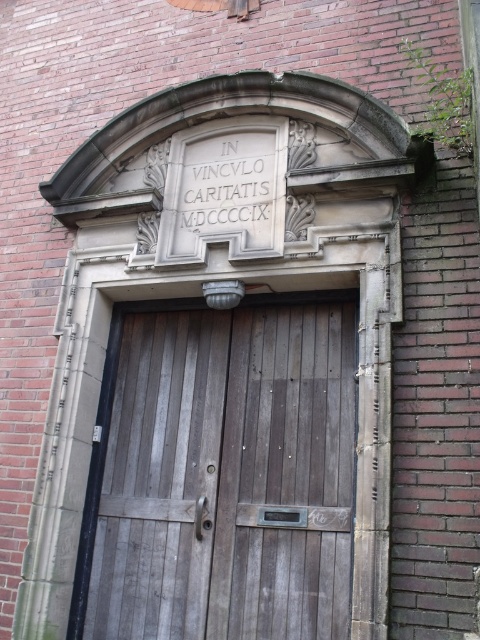
Question: Is wooden door at center further to camera compared to white stone inscription at center?

Choices:
 (A) no
 (B) yes

Answer: (A)

Question: Does wooden door at center appear on the right side of white stone inscription at center?

Choices:
 (A) yes
 (B) no

Answer: (B)

Question: Does wooden door at center come behind white stone inscription at center?

Choices:
 (A) no
 (B) yes

Answer: (A)

Question: Among these points, which one is farthest from the camera?

Choices:
 (A) (240, 216)
 (B) (335, 598)

Answer: (A)

Question: Which object appears closest to the camera in this image?

Choices:
 (A) white stone inscription at center
 (B) wooden door at center

Answer: (B)

Question: Which point is farther to the camera?

Choices:
 (A) white stone inscription at center
 (B) wooden door at center

Answer: (A)